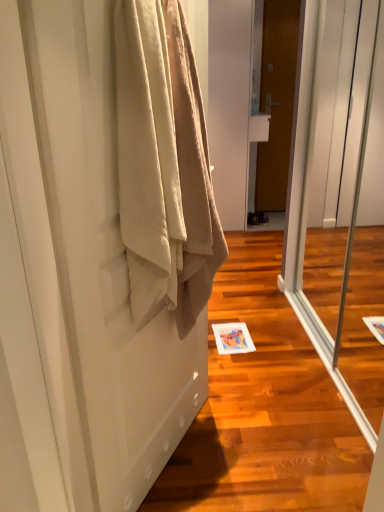
The image size is (384, 512). What are the coordinates of `free area below transparent glass screen door at center (from a real-world perspective)` in the screenshot? It's located at (349, 377).